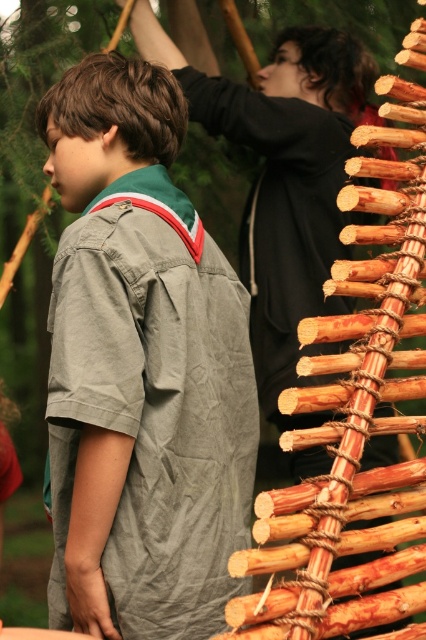
You are a photographer trying to capture both the gray cotton shirt at center and the smooth black hoodie at upper center in a single shot. Based on their positions, which one should you adjust your camera to focus on first to ensure both are in frame?

The gray cotton shirt at center is positioned on the left side of smooth black hoodie at upper center, so you should focus on the smooth black hoodie at upper center first to ensure both are in frame.

You are standing at the point marked as point (141, 371). What object is located exactly at this point?

The gray cotton shirt at center is located exactly at point (141, 371).

You are a parent trying to locate your child in a park. You see the gray cotton shirt at center and the smooth black hoodie at upper center. How far apart are these two children?

The gray cotton shirt at center and the smooth black hoodie at upper center are 3.37 feet apart from each other.